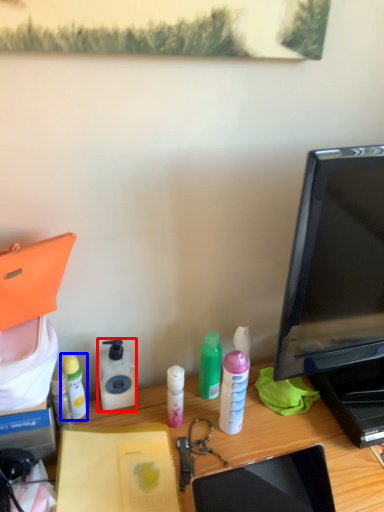
Question: Which of the following is the closest to the observer, bottle (highlighted by a red box) or bottle (highlighted by a blue box)?

Choices:
 (A) bottle
 (B) bottle

Answer: (B)